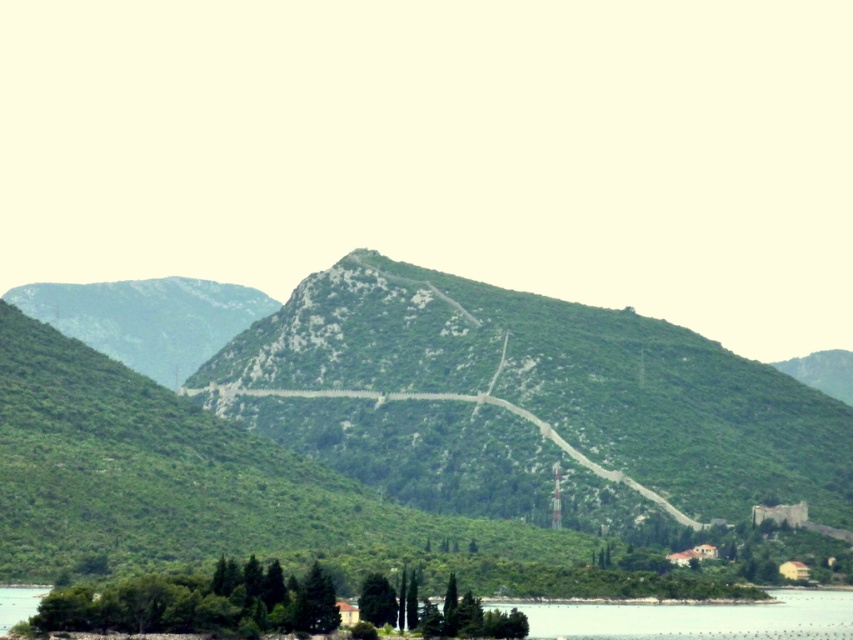
Locate an element on the screen. green textured hill at center is located at coordinates (524, 401).

Can you confirm if green textured hill at center is positioned above green stone path at center?

Yes.

Measure the distance between green textured hill at center and camera.

A distance of 647.19 meters exists between green textured hill at center and camera.

Locate an element on the screen. Image resolution: width=853 pixels, height=640 pixels. green textured hill at center is located at coordinates pyautogui.click(x=524, y=401).